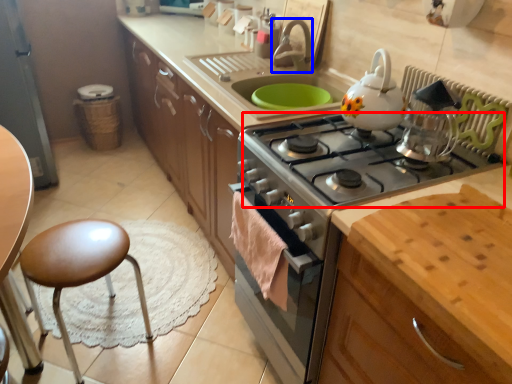
Question: Which object is further to the camera taking this photo, gas stove (highlighted by a red box) or faucet (highlighted by a blue box)?

Choices:
 (A) gas stove
 (B) faucet

Answer: (B)